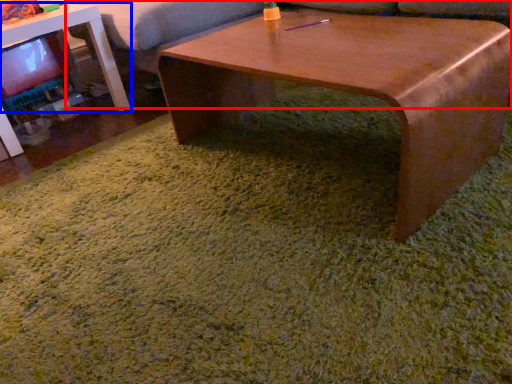
Question: Among these objects, which one is nearest to the camera, couch (highlighted by a red box) or table (highlighted by a blue box)?

Choices:
 (A) couch
 (B) table

Answer: (B)